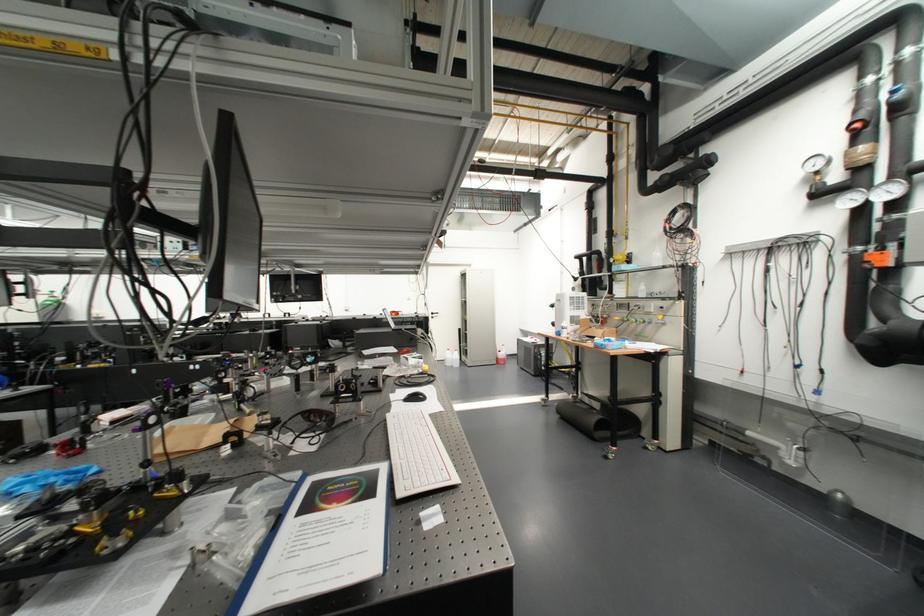
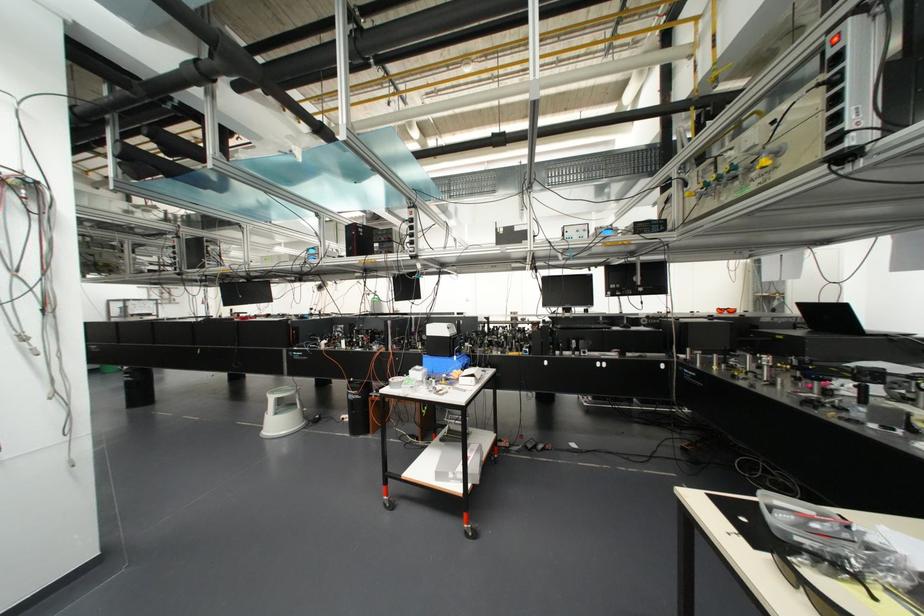
Question: In a continuous first-person perspective shot, in which direction is the camera moving?

Choices:
 (A) Left
 (B) Right
 (C) Forward
 (D) Backward

Answer: (A)